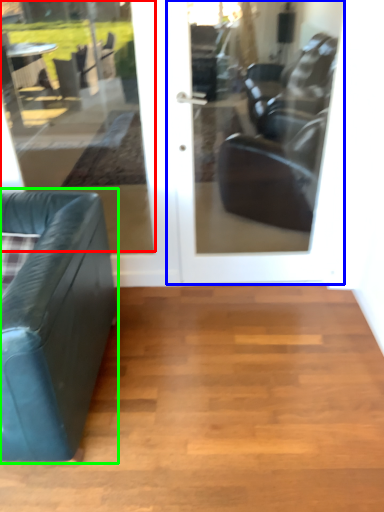
Question: Considering the real-world distances, which object is farthest from window (highlighted by a red box)? door (highlighted by a blue box) or studio couch (highlighted by a green box)?

Choices:
 (A) door
 (B) studio couch

Answer: (B)